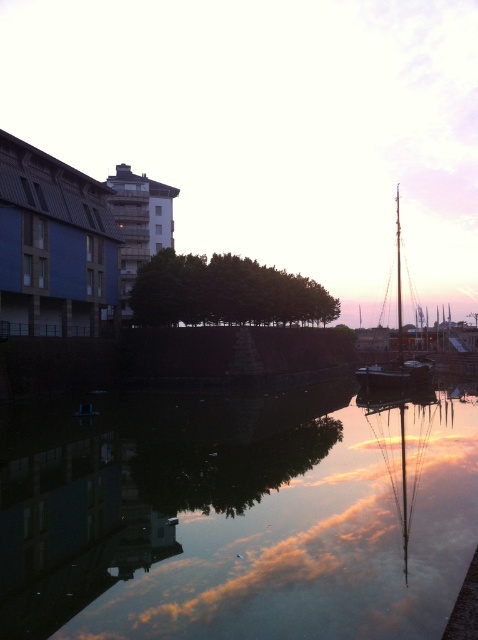
Can you confirm if smooth reflective water at center is smaller than wooden sailboat at right?

Yes, smooth reflective water at center is smaller than wooden sailboat at right.

Does smooth reflective water at center have a lesser height compared to wooden sailboat at right?

Yes, smooth reflective water at center is shorter than wooden sailboat at right.

Which is behind, point (117, 445) or point (403, 371)?

The point (403, 371) is more distant.

The image size is (478, 640). What are the coordinates of `smooth reflective water at center` in the screenshot? It's located at (237, 515).